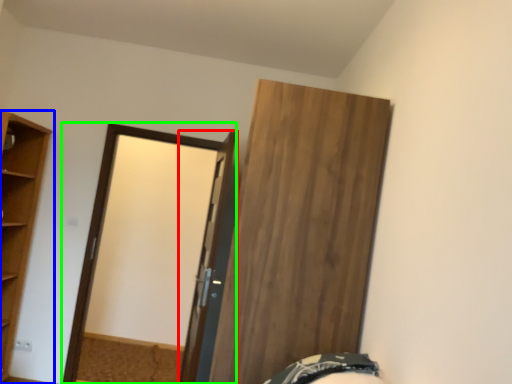
Question: Based on their relative distances, which object is nearer to door (highlighted by a red box)? Choose from cupboard (highlighted by a blue box) and screen door (highlighted by a green box).

Choices:
 (A) cupboard
 (B) screen door

Answer: (B)